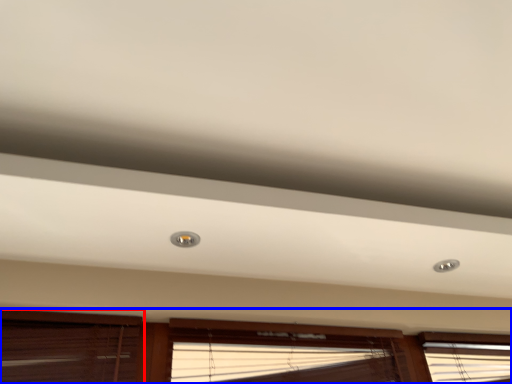
Question: Which object appears farthest to the camera in this image, window (highlighted by a red box) or window (highlighted by a blue box)?

Choices:
 (A) window
 (B) window

Answer: (B)